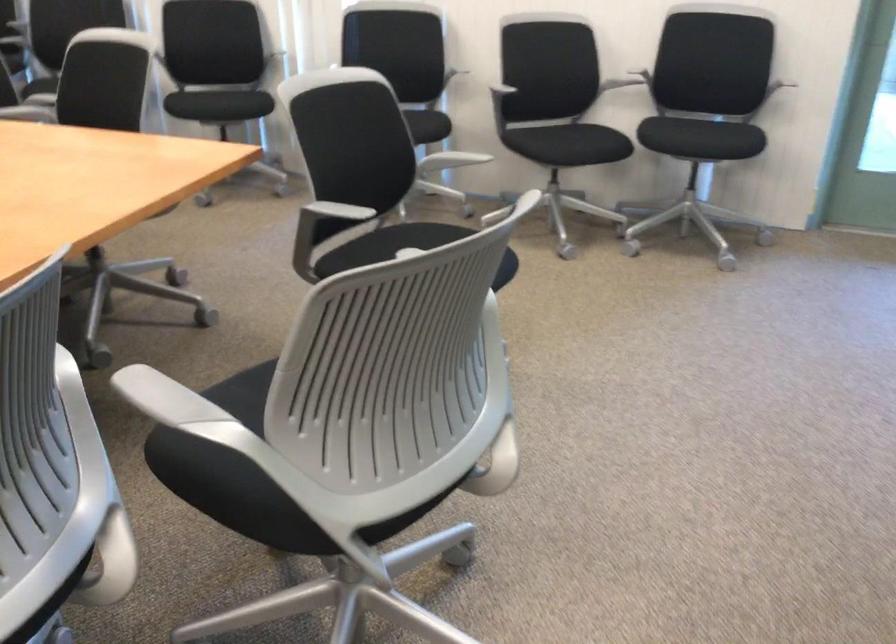
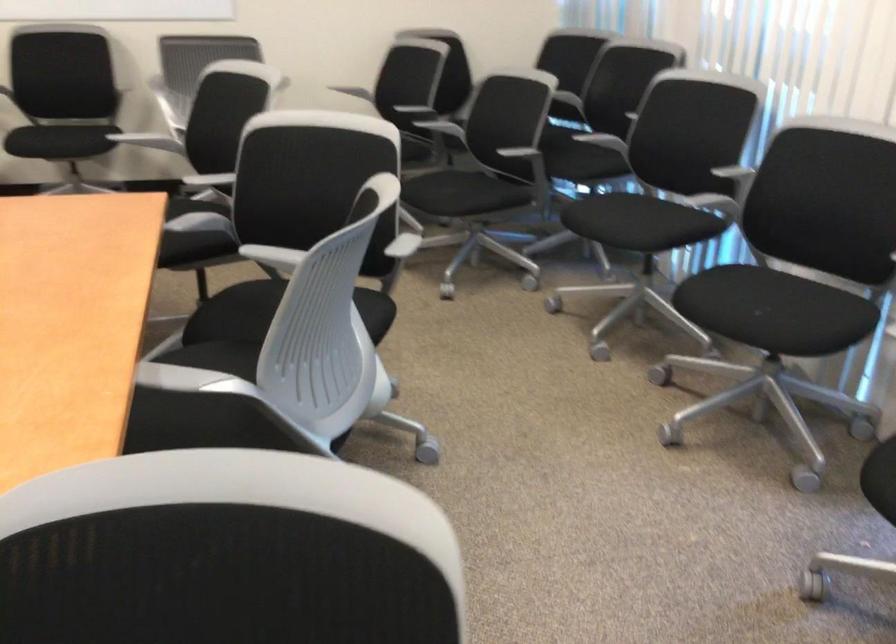
Find the pixel in the second image that matches (231,91) in the first image.

(771, 310)